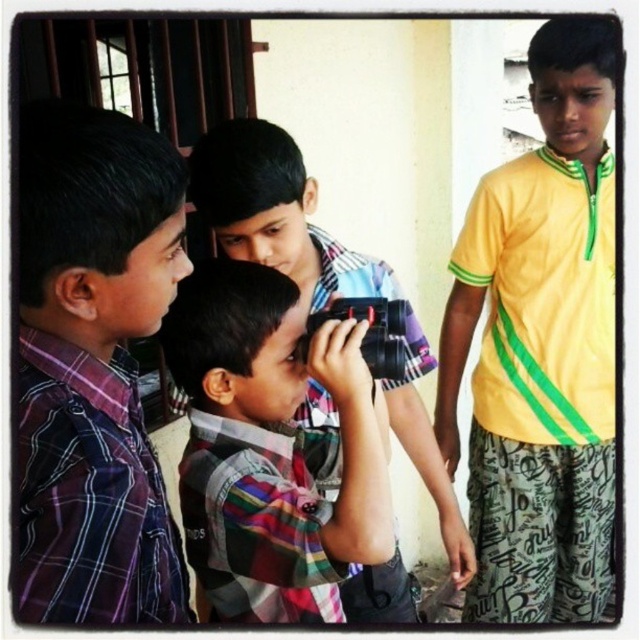
Question: Does yellow smooth shirt at right have a lesser width compared to striped cotton shirt at center?

Choices:
 (A) yes
 (B) no

Answer: (A)

Question: Which point is closer to the camera?

Choices:
 (A) black plastic camera at center
 (B) plaid shirt camera at center
 (C) yellow smooth shirt at right
 (D) purple plaid shirt at left

Answer: (D)

Question: Can you confirm if yellow smooth shirt at right is positioned to the left of plaid shirt camera at center?

Choices:
 (A) no
 (B) yes

Answer: (A)

Question: Which point is farther to the camera?

Choices:
 (A) (294, 586)
 (B) (337, 432)
 (C) (385, 369)
 (D) (58, 180)

Answer: (B)

Question: From the image, what is the correct spatial relationship of striped cotton shirt at center in relation to black plastic camera at center?

Choices:
 (A) below
 (B) above

Answer: (A)

Question: Which of these objects is positioned closest to the purple plaid shirt at left?

Choices:
 (A) black plastic camera at center
 (B) yellow smooth shirt at right
 (C) plaid shirt camera at center
 (D) striped cotton shirt at center

Answer: (C)